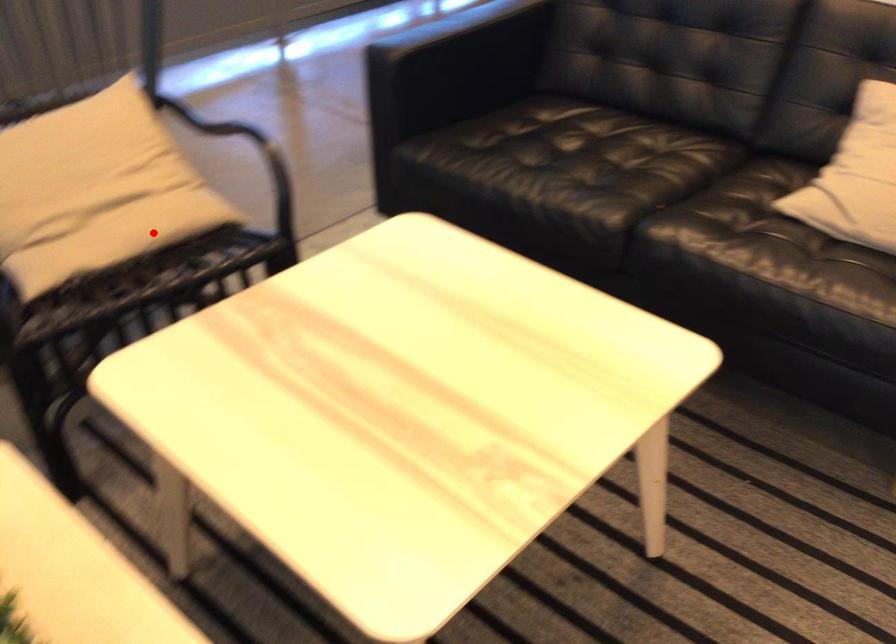
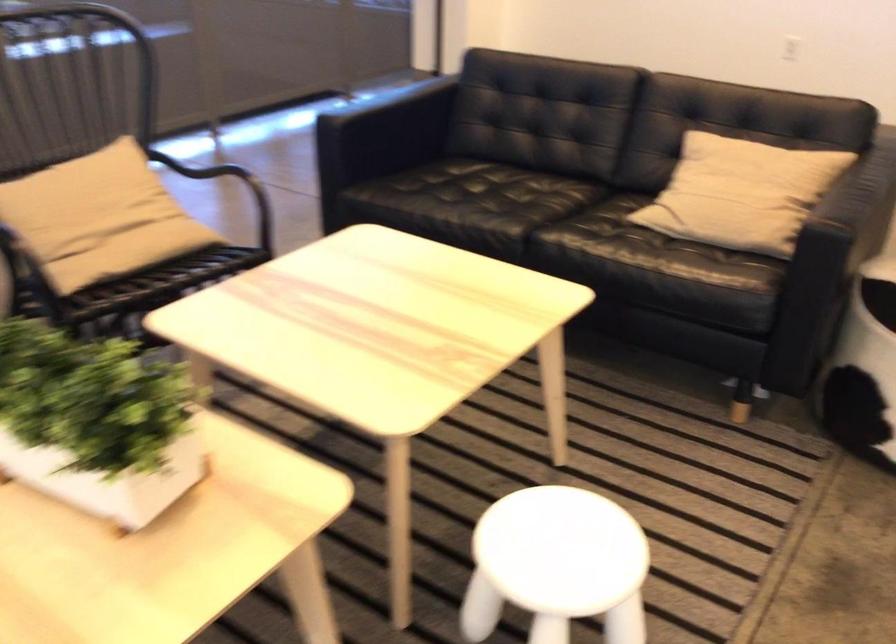
Question: I am providing you with two images of the same scene from different viewpoints. In image1, a red point is highlighted. Considering the same 3D point in image2, which of the following is correct?

Choices:
 (A) It is closer
 (B) It is farther

Answer: (B)